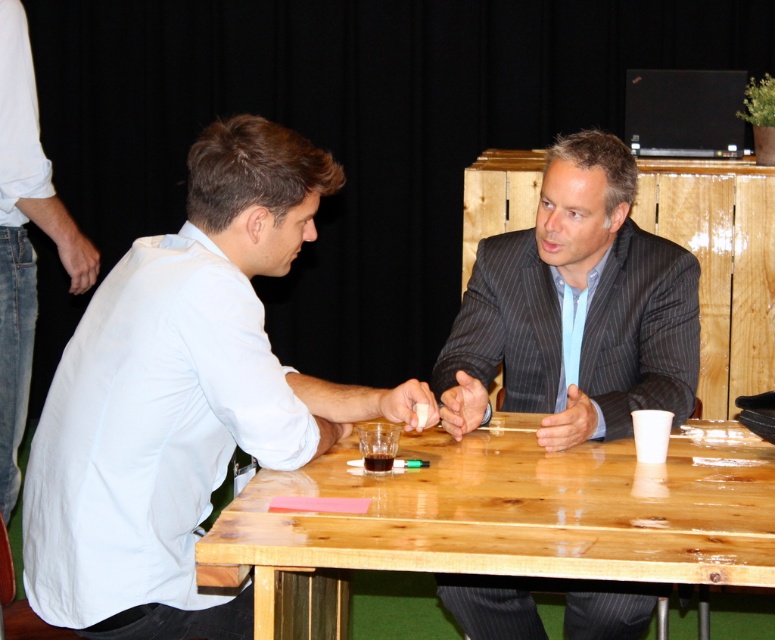
Question: Is white matte shirt at left thinner than dark gray pinstripe suit at center?

Choices:
 (A) yes
 (B) no

Answer: (B)

Question: Is white matte shirt at left wider than dark gray pinstripe suit at center?

Choices:
 (A) yes
 (B) no

Answer: (A)

Question: Is white matte shirt at left smaller than white cotton shirt at left?

Choices:
 (A) yes
 (B) no

Answer: (B)

Question: Which is nearer to the white matte shirt at left?

Choices:
 (A) wooden table at center
 (B) dark gray pinstripe suit at center

Answer: (A)

Question: Based on their relative distances, which object is nearer to the wooden table at center?

Choices:
 (A) white matte shirt at left
 (B) dark gray pinstripe suit at center

Answer: (B)

Question: Considering the real-world distances, which object is closest to the white cotton shirt at left?

Choices:
 (A) white matte shirt at left
 (B) wooden table at center
 (C) dark gray pinstripe suit at center

Answer: (A)